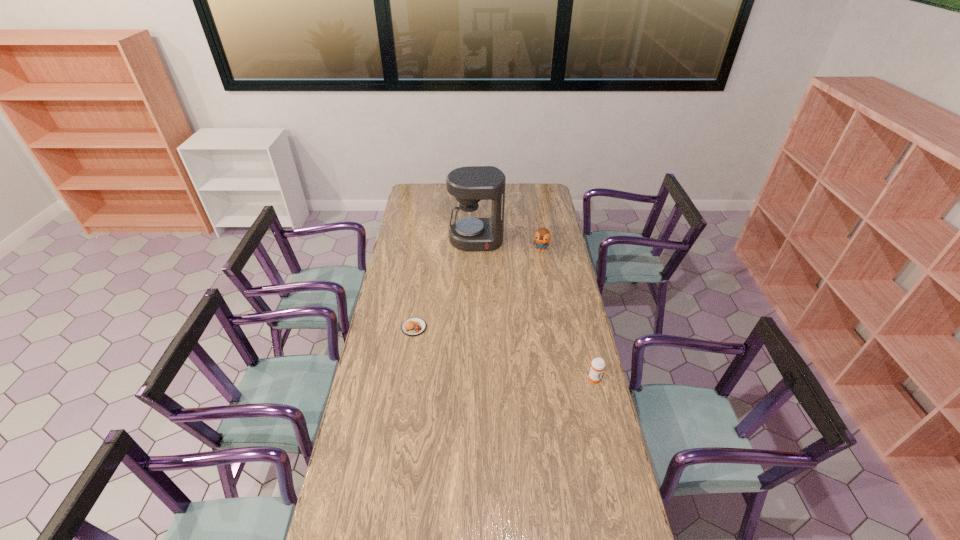
What are the coordinates of `vacant area at the left edge` in the screenshot? It's located at (410, 298).

In the image, there is a desktop. At what (x,y) coordinates should I click in order to perform the action: click on free space at the right edge. Please return your answer as a coordinate pair (x, y). Image resolution: width=960 pixels, height=540 pixels. Looking at the image, I should click on (584, 359).

This screenshot has width=960, height=540. Find the location of `blank area at the far left corner`. blank area at the far left corner is located at coordinates (415, 184).

This screenshot has width=960, height=540. Find the location of `free point between the tallest object and the second tallest object`. free point between the tallest object and the second tallest object is located at coordinates [509, 245].

This screenshot has height=540, width=960. Find the location of `free space between the second tallest object and the patty`. free space between the second tallest object and the patty is located at coordinates (478, 289).

You are a GUI agent. You are given a task and a screenshot of the screen. Output one action in this format:
    pyautogui.click(x=<x>, y=<y>)
    Task: Click on the vacant space that is in between the patty and the nearest object
    
    Given the screenshot: What is the action you would take?
    pyautogui.click(x=504, y=353)

The width and height of the screenshot is (960, 540). What are the coordinates of `free space between the tallest object and the duck` in the screenshot? It's located at (509, 245).

The width and height of the screenshot is (960, 540). I want to click on vacant region between the coffee maker and the third object from left to right, so click(x=509, y=245).

Find the location of a particular element. The image size is (960, 540). free space between the third farthest object and the second shortest object is located at coordinates (504, 353).

Find the location of a particular element. Image resolution: width=960 pixels, height=540 pixels. free spot between the third shortest object and the medicine is located at coordinates (567, 315).